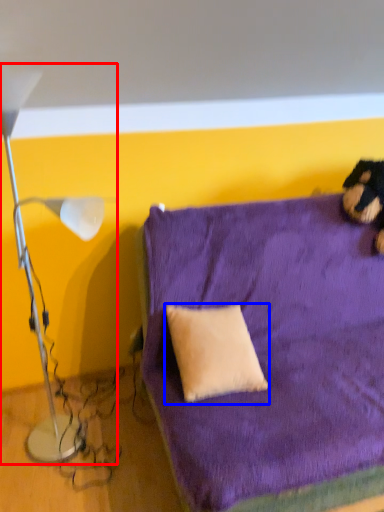
Question: Which of the following is the closest to the observer, lamp (highlighted by a red box) or pillow (highlighted by a blue box)?

Choices:
 (A) lamp
 (B) pillow

Answer: (A)